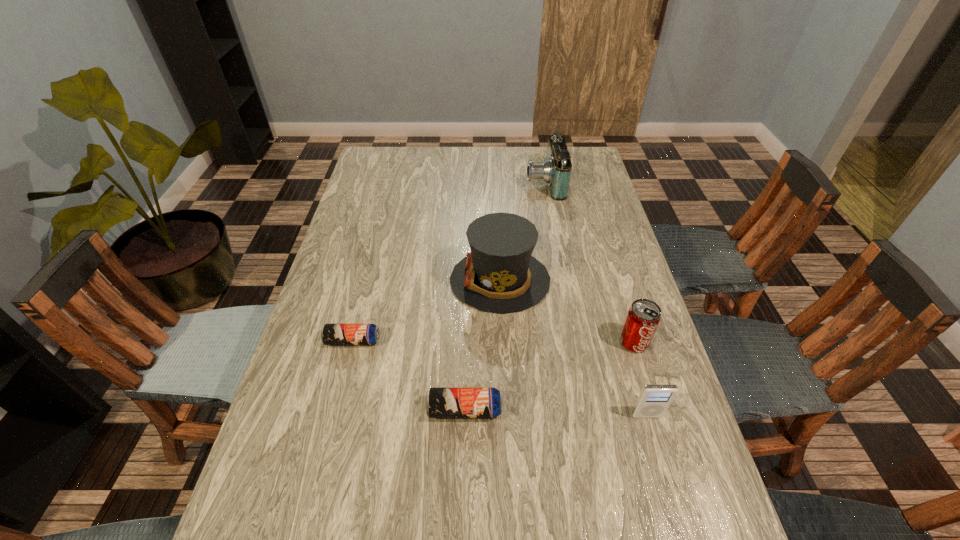
Locate an element on the screen. The width and height of the screenshot is (960, 540). the farther beer can is located at coordinates (331, 334).

Identify the location of the left beer can. (331, 334).

Locate an element on the screen. This screenshot has width=960, height=540. the taller beer can is located at coordinates (440, 402).

Locate an element on the screen. the right beer can is located at coordinates tap(440, 402).

Identify the location of the second farthest object. The width and height of the screenshot is (960, 540). (499, 275).

Where is `dress hat`? The width and height of the screenshot is (960, 540). dress hat is located at coordinates (499, 275).

At what (x,y) coordinates should I click in order to perform the action: click on pop soda. Please return your answer as a coordinate pair (x, y). This screenshot has width=960, height=540. Looking at the image, I should click on coord(643,317).

The image size is (960, 540). I want to click on the farthest object, so click(x=555, y=170).

This screenshot has width=960, height=540. I want to click on iPod, so click(x=654, y=400).

Identify the location of free space located 0.320m on the back of the shortest object. (375, 252).